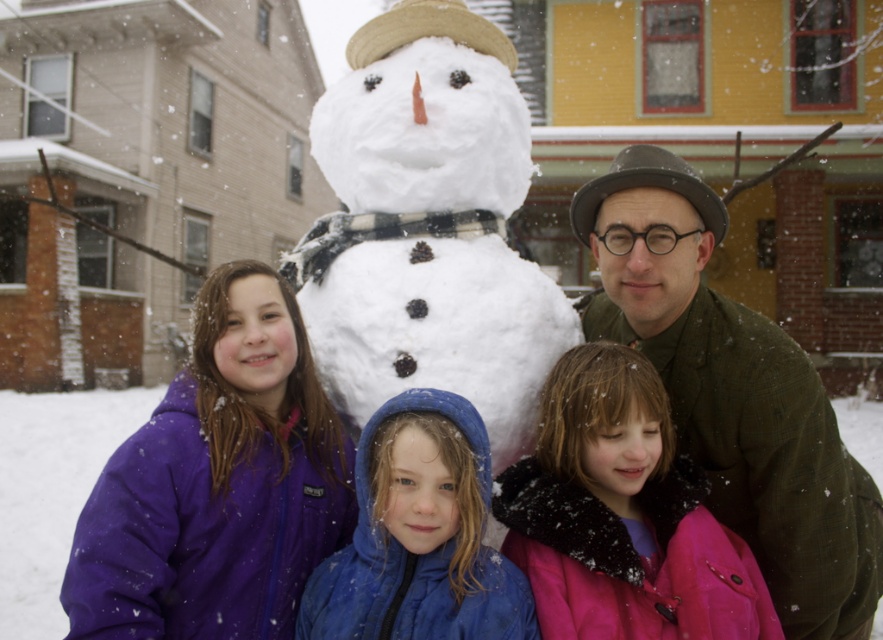
Looking at this image, you are standing at point [308,612] and want to walk to the snowman. Is there a clear path from your current position to the snowman without crossing point [321,218]?

Since point [321,218] is behind point [308,612], there is a clear path to the snowman without crossing point [321,218].